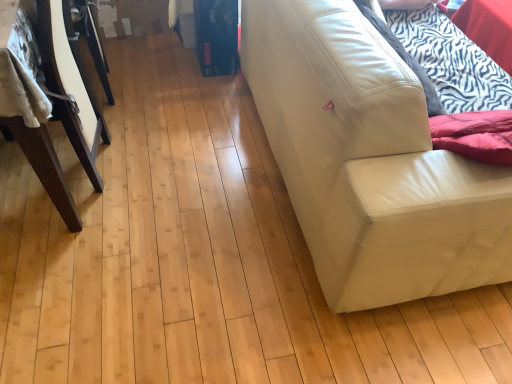
This screenshot has height=384, width=512. What do you see at coordinates (61, 78) in the screenshot? I see `dark brown wood table at left` at bounding box center [61, 78].

You are a GUI agent. You are given a task and a screenshot of the screen. Output one action in this format:
    pyautogui.click(x=<x>, y=<y>)
    Task: Click on the dark brown wood table at left
    This screenshot has height=384, width=512.
    Given the screenshot: What is the action you would take?
    pyautogui.click(x=61, y=78)

What is the approximate height of white leather couch at right?

It is 30.29 inches.

Find the location of a particular element. The height and width of the screenshot is (384, 512). white leather couch at right is located at coordinates (369, 161).

What do you see at coordinates (369, 161) in the screenshot? The width and height of the screenshot is (512, 384). I see `white leather couch at right` at bounding box center [369, 161].

Consider the image. What is the approximate width of white leather couch at right?

The width of white leather couch at right is 37.81 inches.

Image resolution: width=512 pixels, height=384 pixels. I want to click on dark brown wood table at left, so click(61, 78).

Is white leather couch at right to the left or to the right of dark brown wood table at left in the image?

Clearly, white leather couch at right is on the right of dark brown wood table at left in the image.

Does white leather couch at right come behind dark brown wood table at left?

No, white leather couch at right is closer to the viewer.

Considering the points (404, 135) and (59, 179), which point is in front, point (404, 135) or point (59, 179)?

The point (404, 135) is in front.

From the image's perspective, which is below, white leather couch at right or dark brown wood table at left?

white leather couch at right.

From a real-world perspective, is white leather couch at right located beneath dark brown wood table at left?

Yes, from a real-world perspective, white leather couch at right is below dark brown wood table at left.

Does white leather couch at right have a lesser width compared to dark brown wood table at left?

Correct, the width of white leather couch at right is less than that of dark brown wood table at left.

Which of these two, white leather couch at right or dark brown wood table at left, stands shorter?

dark brown wood table at left.

Consider the image. Can you confirm if white leather couch at right is smaller than dark brown wood table at left?

No, white leather couch at right is not smaller than dark brown wood table at left.

Do you think white leather couch at right is within dark brown wood table at left, or outside of it?

white leather couch at right is spatially situated outside dark brown wood table at left.

Is white leather couch at right not near dark brown wood table at left?

No, white leather couch at right is not far away from dark brown wood table at left.

Could you tell me if white leather couch at right is turned towards dark brown wood table at left?

No, white leather couch at right is not facing towards dark brown wood table at left.

Looking at this image, what's the angular difference between white leather couch at right and dark brown wood table at left's facing directions?

The angle between the facing direction of white leather couch at right and the facing direction of dark brown wood table at left is 90.2 degrees.

Locate an element on the screen. This screenshot has width=512, height=384. studio couch on the right of the dark brown wood table at left is located at coordinates pyautogui.click(x=369, y=161).

Consider the image. Between dark brown wood table at left and white leather couch at right, which one appears on the right side from the viewer's perspective?

From the viewer's perspective, white leather couch at right appears more on the right side.

Who is more distant, dark brown wood table at left or white leather couch at right?

Positioned behind is dark brown wood table at left.

Which is less distant, (64, 86) or (312, 198)?

Point (64, 86).

From the image's perspective, between dark brown wood table at left and white leather couch at right, who is located below?

white leather couch at right.

From a real-world perspective, who is located higher, dark brown wood table at left or white leather couch at right?

dark brown wood table at left, from a real-world perspective.

Considering the sizes of dark brown wood table at left and white leather couch at right in the image, is dark brown wood table at left wider or thinner than white leather couch at right?

In the image, dark brown wood table at left appears to be wider than white leather couch at right.

Considering the relative sizes of dark brown wood table at left and white leather couch at right in the image provided, is dark brown wood table at left shorter than white leather couch at right?

Correct, dark brown wood table at left is not as tall as white leather couch at right.

Considering the sizes of objects dark brown wood table at left and white leather couch at right in the image provided, who is smaller, dark brown wood table at left or white leather couch at right?

dark brown wood table at left.

Could white leather couch at right be considered to be inside dark brown wood table at left?

No.

Is dark brown wood table at left placed right next to white leather couch at right?

dark brown wood table at left and white leather couch at right are not in contact.

Could you tell me if dark brown wood table at left is turned towards white leather couch at right?

No, dark brown wood table at left is not oriented towards white leather couch at right.

This screenshot has width=512, height=384. I want to click on studio couch on the right of dark brown wood table at left, so click(x=369, y=161).

Locate an element on the screen. studio couch on the right of dark brown wood table at left is located at coordinates (369, 161).

This screenshot has width=512, height=384. I want to click on furniture that is above the white leather couch at right (from the image's perspective), so click(61, 78).